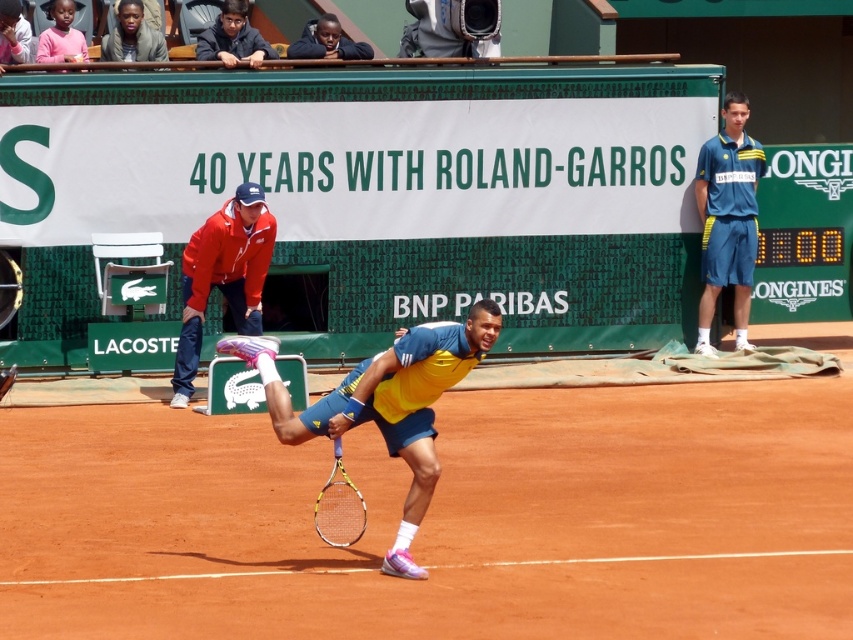
Question: Which of the following is the closest to the observer?

Choices:
 (A) dark blue jacket at upper center
 (B) matte red jacket at upper left
 (C) blue fabric shorts at right
 (D) brown clay tennis court at center

Answer: (D)

Question: Among these points, which one is nearest to the camera?

Choices:
 (A) (218, 36)
 (B) (498, 320)
 (C) (131, 532)
 (D) (733, 161)

Answer: (B)

Question: Is matte red jacket at upper left smaller than dark blue fabric jacket at upper center?

Choices:
 (A) yes
 (B) no

Answer: (B)

Question: Can you confirm if dark blue fabric jacket at upper center is positioned below dark blue jacket at upper center?

Choices:
 (A) yes
 (B) no

Answer: (A)

Question: Which point is closer to the camera?

Choices:
 (A) yellow fabric tennis player at center
 (B) matte red jacket at upper left
 (C) yellow and black racket at center
 (D) dark blue fabric jacket at upper center

Answer: (A)

Question: Is yellow fabric tennis player at center above blue fabric shorts at right?

Choices:
 (A) yes
 (B) no

Answer: (B)